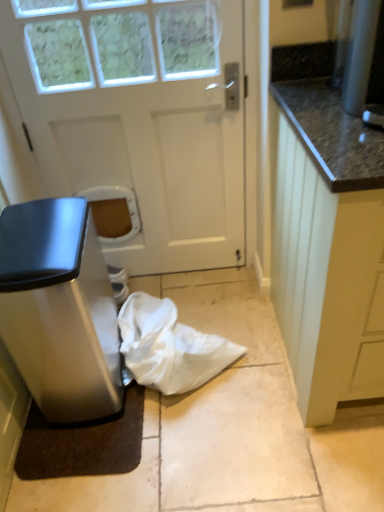
Question: Does point (235, 116) appear closer or farther from the camera than point (377, 366)?

Choices:
 (A) farther
 (B) closer

Answer: (A)

Question: From the image's perspective, is white matte door at center located above or below white wood cabinet at right?

Choices:
 (A) below
 (B) above

Answer: (B)

Question: Estimate the real-world distances between objects in this image. Which object is closer to the white wood cabinet at right?

Choices:
 (A) white matte door at center
 (B) satin silver trash can at left
 (C) white fabric bag at lower center

Answer: (C)

Question: Which object is positioned closest to the white matte door at center?

Choices:
 (A) white fabric bag at lower center
 (B) white wood cabinet at right
 (C) satin silver trash can at left

Answer: (C)